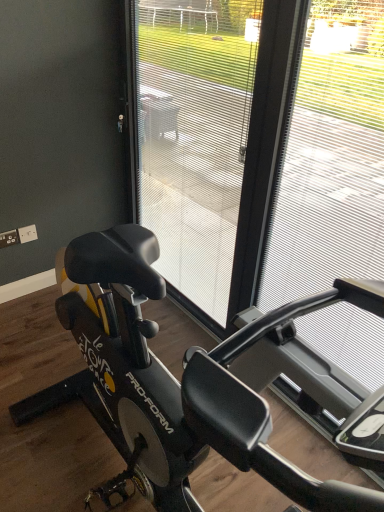
Question: Does black matte stationary bicycle at center have a lesser height compared to transparent plastic screen door at center?

Choices:
 (A) yes
 (B) no

Answer: (A)

Question: Is black matte stationary bicycle at center surrounding transparent plastic screen door at center?

Choices:
 (A) yes
 (B) no

Answer: (B)

Question: Does black matte stationary bicycle at center have a smaller size compared to transparent plastic screen door at center?

Choices:
 (A) yes
 (B) no

Answer: (A)

Question: Is black matte stationary bicycle at center taller than transparent plastic screen door at center?

Choices:
 (A) no
 (B) yes

Answer: (A)

Question: Considering the relative positions of black matte stationary bicycle at center and transparent plastic screen door at center in the image provided, is black matte stationary bicycle at center in front of transparent plastic screen door at center?

Choices:
 (A) no
 (B) yes

Answer: (B)

Question: From a real-world perspective, is black matte stationary bicycle at center positioned under transparent plastic screen door at center based on gravity?

Choices:
 (A) yes
 (B) no

Answer: (A)

Question: Is black matte stationary bicycle at center to the left of metallic silver frame at right from the viewer's perspective?

Choices:
 (A) no
 (B) yes

Answer: (B)

Question: Does black matte stationary bicycle at center have a lesser height compared to metallic silver frame at right?

Choices:
 (A) no
 (B) yes

Answer: (B)

Question: Is the position of black matte stationary bicycle at center more distant than that of metallic silver frame at right?

Choices:
 (A) no
 (B) yes

Answer: (B)

Question: Is black matte stationary bicycle at center next to metallic silver frame at right and touching it?

Choices:
 (A) no
 (B) yes

Answer: (A)

Question: From the image's perspective, is black matte stationary bicycle at center above metallic silver frame at right?

Choices:
 (A) yes
 (B) no

Answer: (B)

Question: Is black matte stationary bicycle at center not within metallic silver frame at right?

Choices:
 (A) yes
 (B) no

Answer: (A)

Question: Considering the relative sizes of metallic silver frame at right and black matte stationary bicycle at center in the image provided, is metallic silver frame at right smaller than black matte stationary bicycle at center?

Choices:
 (A) no
 (B) yes

Answer: (A)